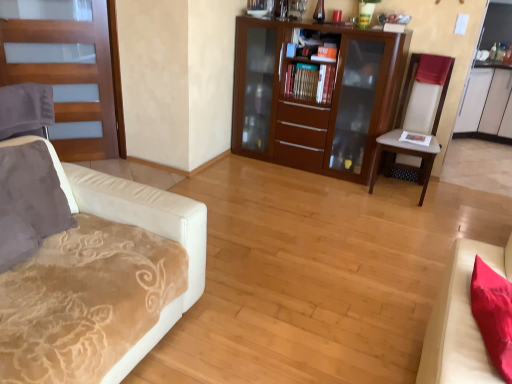
Question: Is hardcover books at center located outside suede-like gray pillow at left?

Choices:
 (A) no
 (B) yes

Answer: (B)

Question: From the image's perspective, is hardcover books at center over suede-like gray pillow at left?

Choices:
 (A) yes
 (B) no

Answer: (A)

Question: Is hardcover books at center shorter than suede-like gray pillow at left?

Choices:
 (A) yes
 (B) no

Answer: (A)

Question: Does hardcover books at center have a smaller size compared to suede-like gray pillow at left?

Choices:
 (A) no
 (B) yes

Answer: (B)

Question: Considering the relative positions of hardcover books at center and suede-like gray pillow at left in the image provided, is hardcover books at center to the left of suede-like gray pillow at left from the viewer's perspective?

Choices:
 (A) no
 (B) yes

Answer: (A)

Question: Is hardcover books at center facing away from suede-like gray pillow at left?

Choices:
 (A) yes
 (B) no

Answer: (B)

Question: From a real-world perspective, is wooden door at left on top of hardcover books at center?

Choices:
 (A) yes
 (B) no

Answer: (B)

Question: Is wooden door at left oriented away from hardcover books at center?

Choices:
 (A) no
 (B) yes

Answer: (A)

Question: Is wooden door at left not within hardcover books at center?

Choices:
 (A) yes
 (B) no

Answer: (A)

Question: Are wooden door at left and hardcover books at center far apart?

Choices:
 (A) yes
 (B) no

Answer: (A)

Question: Can you confirm if wooden door at left is wider than hardcover books at center?

Choices:
 (A) no
 (B) yes

Answer: (A)

Question: Considering the relative sizes of wooden door at left and hardcover books at center in the image provided, is wooden door at left taller than hardcover books at center?

Choices:
 (A) no
 (B) yes

Answer: (B)

Question: Is beige fabric chair at right far from hardcover books at center?

Choices:
 (A) yes
 (B) no

Answer: (B)